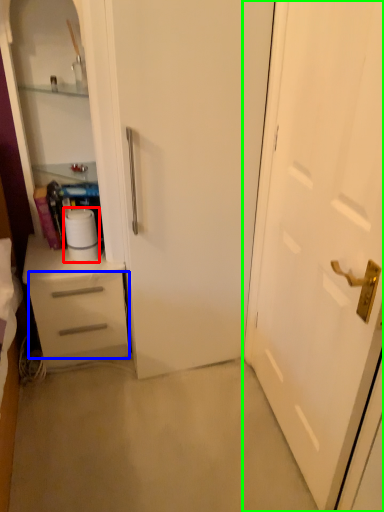
Question: Based on their relative distances, which object is nearer to paper towel (highlighted by a red box)? Choose from drawer (highlighted by a blue box) and door (highlighted by a green box).

Choices:
 (A) drawer
 (B) door

Answer: (A)